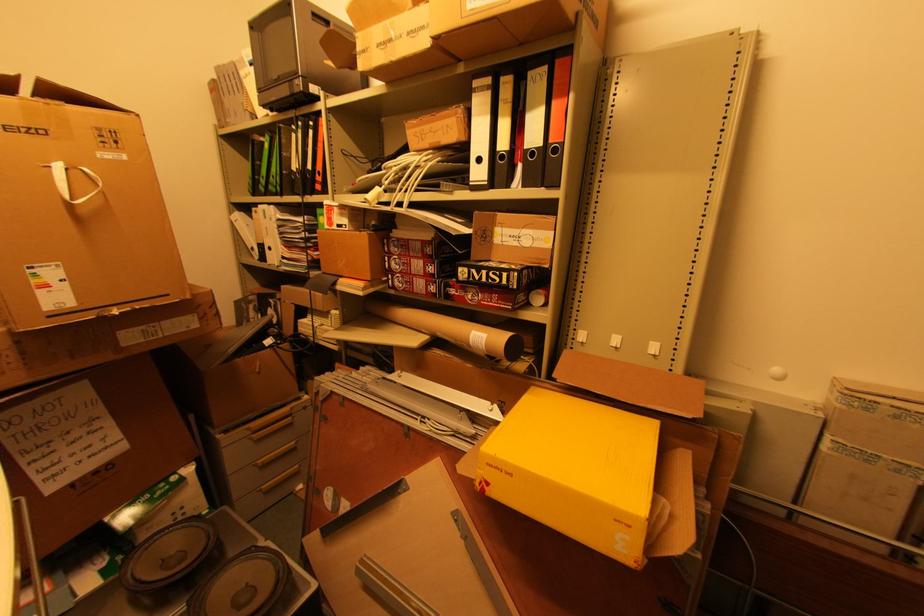
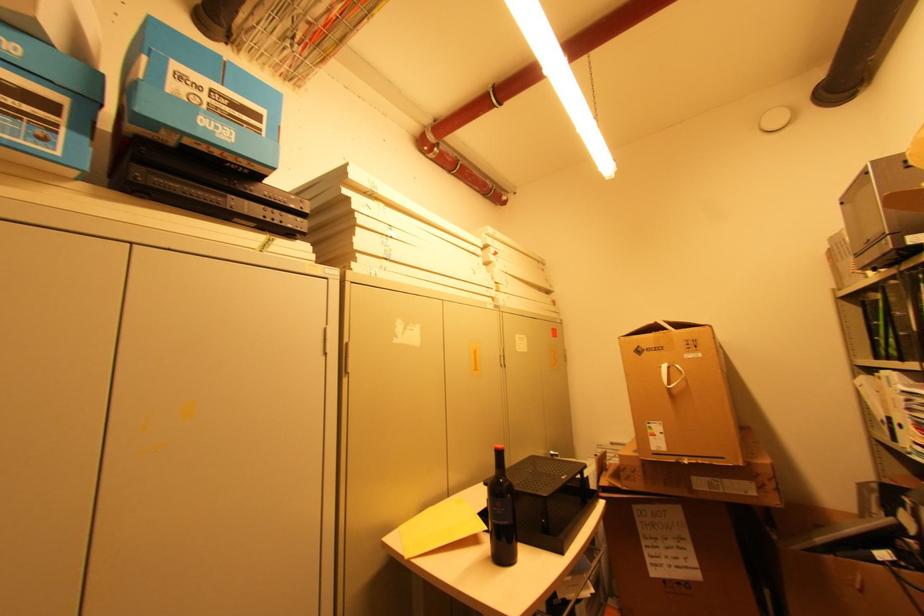
Where in the second image is the point corresponding to point 74,207 from the first image?

(672, 390)